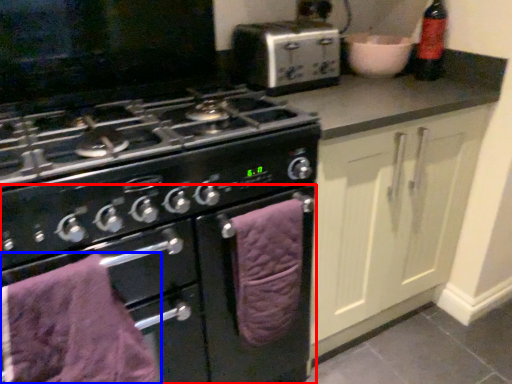
Question: Which of the following is the closest to the observer, oven (highlighted by a red box) or bath towel (highlighted by a blue box)?

Choices:
 (A) oven
 (B) bath towel

Answer: (B)